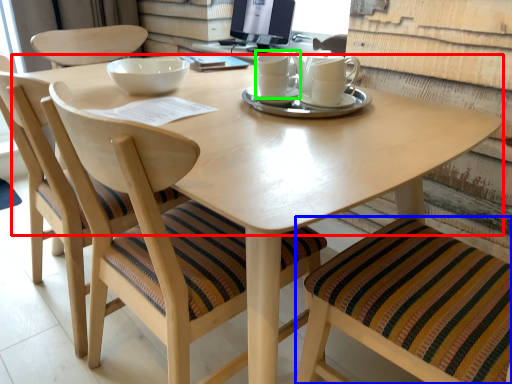
Question: Estimate the real-world distances between objects in this image. Which object is farther from round table (highlighted by a red box), chair (highlighted by a blue box) or coffee cup (highlighted by a green box)?

Choices:
 (A) chair
 (B) coffee cup

Answer: (A)